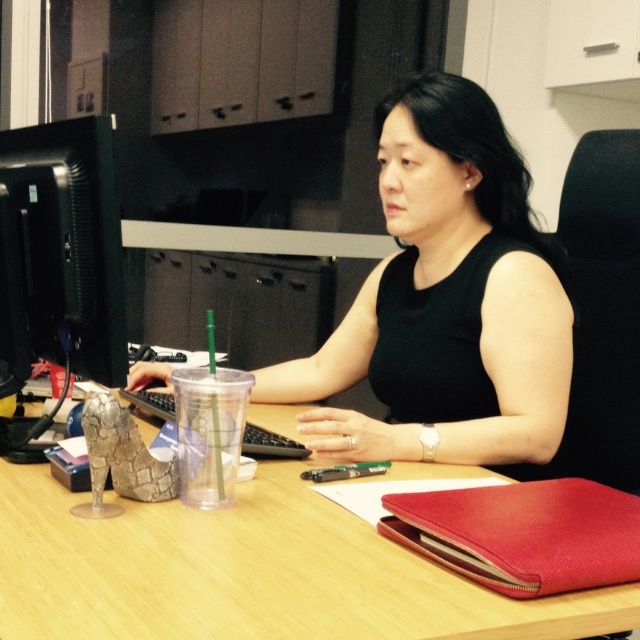
What are the coordinates of the black matte dress at center in the image?

The black matte dress at center is located at coordinates point (445, 301).

Based on the photo, you are a delivery robot with a package that is 15 inches wide. You need to place it on the desk between the wooden table at center and the black matte computer monitor at left. Is there enough space for the package?

The distance between the wooden table at center and the black matte computer monitor at left is 14.23 inches. Since the package is 15 inches wide, it is wider than the available space, so the package will not fit between them.

What are the coordinates of the wooden table at center?

The wooden table at center is located at point (250, 572).